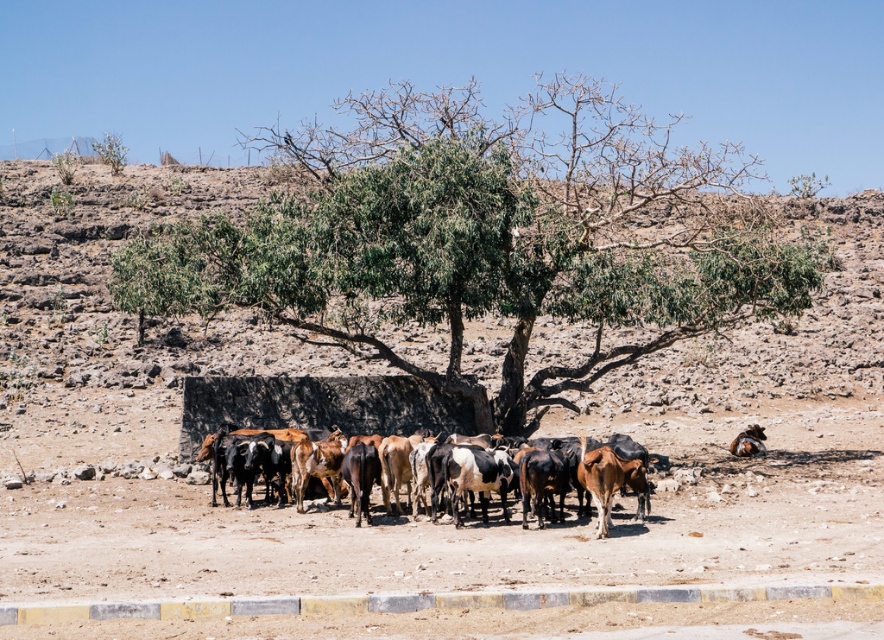
Can you confirm if dull brown dirt field at center is bigger than green leafy tree at center?

Incorrect, dull brown dirt field at center is not larger than green leafy tree at center.

Can you confirm if dull brown dirt field at center is positioned to the left of green leafy tree at center?

In fact, dull brown dirt field at center is to the right of green leafy tree at center.

Measure the distance between dull brown dirt field at center and camera.

32.95 feet

Identify the location of dull brown dirt field at center. (402, 433).

Is dull brown dirt field at center taller than brown/cracked earth cows at center?

Correct, dull brown dirt field at center is much taller as brown/cracked earth cows at center.

Where is `dull brown dirt field at center`? The image size is (884, 640). dull brown dirt field at center is located at coordinates (402, 433).

Between point (851, 502) and point (208, 438), which one is positioned behind?

The point (208, 438) is more distant.

I want to click on dull brown dirt field at center, so click(402, 433).

Can you confirm if green leafy tree at center is shorter than brown/cracked earth cows at center?

No, green leafy tree at center is not shorter than brown/cracked earth cows at center.

Does point (558, 209) lie in front of point (208, 444)?

That is False.

Who is more forward, (356, 320) or (287, 432)?

Positioned in front is point (287, 432).

Identify the location of green leafy tree at center. (485, 237).